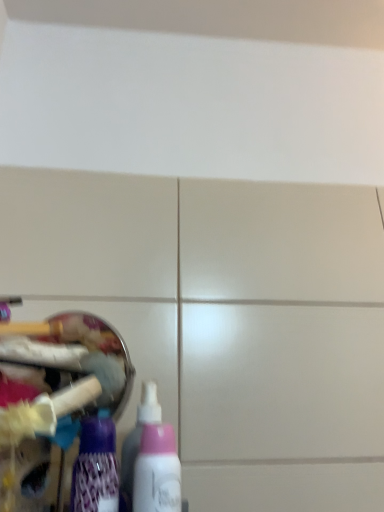
Measure the distance between point (101, 480) and camera.

Point (101, 480) and camera are 17.36 inches apart from each other.

This screenshot has width=384, height=512. What are the coordinates of `pink plastic bottle at lower left, which ranks as the 3th bottle in left-to-right order` in the screenshot? It's located at (157, 471).

Where is `pink matte bottle at lower left, placed as the second bottle when sorted from right to left`? pink matte bottle at lower left, placed as the second bottle when sorted from right to left is located at coordinates (137, 441).

From the image's perspective, is purple glossy bottle at lower left, positioned as the 1th bottle in left-to-right order, above pink matte bottle at lower left, the second bottle viewed from the left?

Yes, from the image's perspective, purple glossy bottle at lower left, positioned as the 1th bottle in left-to-right order, is on top of pink matte bottle at lower left, the second bottle viewed from the left.

At what (x,y) coordinates should I click in order to perform the action: click on bottle that appears above the purple glossy bottle at lower left, the third bottle positioned from the right (from a real-world perspective). Please return your answer as a coordinate pair (x, y). This screenshot has width=384, height=512. Looking at the image, I should click on (137, 441).

Is the position of purple glossy bottle at lower left, positioned as the 1th bottle in left-to-right order, more distant than that of pink matte bottle at lower left, placed as the second bottle when sorted from right to left?

No, it is not.

From a real-world perspective, is purple glossy bottle at lower left, positioned as the 1th bottle in left-to-right order, positioned over pink matte bottle at lower left, placed as the second bottle when sorted from right to left, based on gravity?

Incorrect, from a real-world perspective, purple glossy bottle at lower left, positioned as the 1th bottle in left-to-right order, is lower than pink matte bottle at lower left, placed as the second bottle when sorted from right to left.

Looking at this image, how many degrees apart are the facing directions of pink plastic bottle at lower left, which ranks as the 3th bottle in left-to-right order, and purple glossy bottle at lower left, the third bottle positioned from the right?

The facing directions of pink plastic bottle at lower left, which ranks as the 3th bottle in left-to-right order, and purple glossy bottle at lower left, the third bottle positioned from the right, are 2.7e-05 degrees apart.

Between pink plastic bottle at lower left, which ranks as the 3th bottle in left-to-right order, and purple glossy bottle at lower left, the third bottle positioned from the right, which one has larger width?

purple glossy bottle at lower left, the third bottle positioned from the right, is wider.

Would you say pink plastic bottle at lower left, which ranks as the 3th bottle in left-to-right order, is outside purple glossy bottle at lower left, the third bottle positioned from the right?

Yes, pink plastic bottle at lower left, which ranks as the 3th bottle in left-to-right order, is outside of purple glossy bottle at lower left, the third bottle positioned from the right.

Based on their sizes in the image, would you say purple glossy bottle at lower left, positioned as the 1th bottle in left-to-right order, is bigger or smaller than pink plastic bottle at lower left, the 1th bottle viewed from the right?

purple glossy bottle at lower left, positioned as the 1th bottle in left-to-right order, is bigger than pink plastic bottle at lower left, the 1th bottle viewed from the right.

Could you measure the distance between purple glossy bottle at lower left, positioned as the 1th bottle in left-to-right order, and pink plastic bottle at lower left, the 1th bottle viewed from the right?

purple glossy bottle at lower left, positioned as the 1th bottle in left-to-right order, is 1.98 inches away from pink plastic bottle at lower left, the 1th bottle viewed from the right.

Between purple glossy bottle at lower left, the third bottle positioned from the right, and pink plastic bottle at lower left, which ranks as the 3th bottle in left-to-right order, which one has less height?

With less height is purple glossy bottle at lower left, the third bottle positioned from the right.

From the image's perspective, is purple glossy bottle at lower left, the third bottle positioned from the right, beneath pink plastic bottle at lower left, the 1th bottle viewed from the right?

Actually, purple glossy bottle at lower left, the third bottle positioned from the right, appears above pink plastic bottle at lower left, the 1th bottle viewed from the right, in the image.

How different are the orientations of pink matte bottle at lower left, placed as the second bottle when sorted from right to left, and purple glossy bottle at lower left, the third bottle positioned from the right, in degrees?

The angle between the facing direction of pink matte bottle at lower left, placed as the second bottle when sorted from right to left, and the facing direction of purple glossy bottle at lower left, the third bottle positioned from the right, is 0.000172 degrees.

Which is in front, pink matte bottle at lower left, placed as the second bottle when sorted from right to left, or purple glossy bottle at lower left, positioned as the 1th bottle in left-to-right order?

purple glossy bottle at lower left, positioned as the 1th bottle in left-to-right order, is closer to the camera.

From the picture: Does pink matte bottle at lower left, the second bottle viewed from the left, have a smaller size compared to purple glossy bottle at lower left, the third bottle positioned from the right?

Correct, pink matte bottle at lower left, the second bottle viewed from the left, occupies less space than purple glossy bottle at lower left, the third bottle positioned from the right.

From a real-world perspective, which object rests below the other?

From a 3D spatial view, purple glossy bottle at lower left, the third bottle positioned from the right, is below.

From a real-world perspective, is pink matte bottle at lower left, the second bottle viewed from the left, positioned under pink plastic bottle at lower left, the 1th bottle viewed from the right, based on gravity?

No.

Considering the positions of points (144, 409) and (160, 446), is point (144, 409) closer to camera compared to point (160, 446)?

No, (144, 409) is behind (160, 446).

Which object is thinner, pink matte bottle at lower left, the second bottle viewed from the left, or pink plastic bottle at lower left, which ranks as the 3th bottle in left-to-right order?

pink plastic bottle at lower left, which ranks as the 3th bottle in left-to-right order.

Between pink matte bottle at lower left, placed as the second bottle when sorted from right to left, and pink plastic bottle at lower left, which ranks as the 3th bottle in left-to-right order, which one has larger size?

With larger size is pink plastic bottle at lower left, which ranks as the 3th bottle in left-to-right order.

Based on their positions, is pink plastic bottle at lower left, which ranks as the 3th bottle in left-to-right order, located to the left or right of pink matte bottle at lower left, placed as the second bottle when sorted from right to left?

From the image, it's evident that pink plastic bottle at lower left, which ranks as the 3th bottle in left-to-right order, is to the right of pink matte bottle at lower left, placed as the second bottle when sorted from right to left.

Between pink plastic bottle at lower left, which ranks as the 3th bottle in left-to-right order, and pink matte bottle at lower left, placed as the second bottle when sorted from right to left, which one has more height?

pink matte bottle at lower left, placed as the second bottle when sorted from right to left.

Could you measure the distance between pink plastic bottle at lower left, the 1th bottle viewed from the right, and pink matte bottle at lower left, placed as the second bottle when sorted from right to left?

pink plastic bottle at lower left, the 1th bottle viewed from the right, and pink matte bottle at lower left, placed as the second bottle when sorted from right to left, are 2.36 inches apart from each other.

From the pink plastic bottle at lower left, the 1th bottle viewed from the right, count 2nd bottles backward and point to it. Please provide its 2D coordinates.

[(137, 441)]

Identify the location of bottle that is the 1st one below the pink matte bottle at lower left, placed as the second bottle when sorted from right to left (from a real-world perspective). (96, 468).

You are a GUI agent. You are given a task and a screenshot of the screen. Output one action in this format:
    pyautogui.click(x=<x>, y=<y>)
    Task: Click on the 2nd bottle counting from the left side of the pink plastic bottle at lower left, the 1th bottle viewed from the right
    
    Given the screenshot: What is the action you would take?
    pyautogui.click(x=96, y=468)

Estimate the real-world distances between objects in this image. Which object is further from pink matte bottle at lower left, placed as the second bottle when sorted from right to left, purple glossy bottle at lower left, positioned as the 1th bottle in left-to-right order, or pink plastic bottle at lower left, which ranks as the 3th bottle in left-to-right order?

Based on the image, pink plastic bottle at lower left, which ranks as the 3th bottle in left-to-right order, appears to be further to pink matte bottle at lower left, placed as the second bottle when sorted from right to left.

When comparing their distances from purple glossy bottle at lower left, positioned as the 1th bottle in left-to-right order, does pink matte bottle at lower left, placed as the second bottle when sorted from right to left, or pink plastic bottle at lower left, the 1th bottle viewed from the right, seem further?

pink matte bottle at lower left, placed as the second bottle when sorted from right to left.

Based on their spatial positions, is purple glossy bottle at lower left, the third bottle positioned from the right, or pink matte bottle at lower left, placed as the second bottle when sorted from right to left, closer to pink plastic bottle at lower left, the 1th bottle viewed from the right?

The object closer to pink plastic bottle at lower left, the 1th bottle viewed from the right, is purple glossy bottle at lower left, the third bottle positioned from the right.

When comparing their distances from pink matte bottle at lower left, the second bottle viewed from the left, does pink plastic bottle at lower left, the 1th bottle viewed from the right, or purple glossy bottle at lower left, positioned as the 1th bottle in left-to-right order, seem closer?

purple glossy bottle at lower left, positioned as the 1th bottle in left-to-right order, is positioned closer to the anchor pink matte bottle at lower left, the second bottle viewed from the left.

Looking at the image, which one is located closer to purple glossy bottle at lower left, positioned as the 1th bottle in left-to-right order, pink plastic bottle at lower left, the 1th bottle viewed from the right, or pink matte bottle at lower left, the second bottle viewed from the left?

The object closer to purple glossy bottle at lower left, positioned as the 1th bottle in left-to-right order, is pink plastic bottle at lower left, the 1th bottle viewed from the right.

Looking at the image, which one is located closer to pink plastic bottle at lower left, which ranks as the 3th bottle in left-to-right order, pink matte bottle at lower left, the second bottle viewed from the left, or purple glossy bottle at lower left, the third bottle positioned from the right?

Based on the image, purple glossy bottle at lower left, the third bottle positioned from the right, appears to be nearer to pink plastic bottle at lower left, which ranks as the 3th bottle in left-to-right order.

Where is `bottle between pink plastic bottle at lower left, which ranks as the 3th bottle in left-to-right order, and pink matte bottle at lower left, the second bottle viewed from the left, along the z-axis`? This screenshot has height=512, width=384. bottle between pink plastic bottle at lower left, which ranks as the 3th bottle in left-to-right order, and pink matte bottle at lower left, the second bottle viewed from the left, along the z-axis is located at coordinates (96, 468).